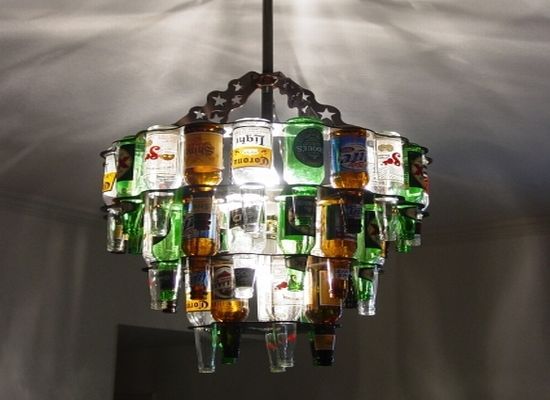
I want to click on bottle chandelier, so click(252, 212).